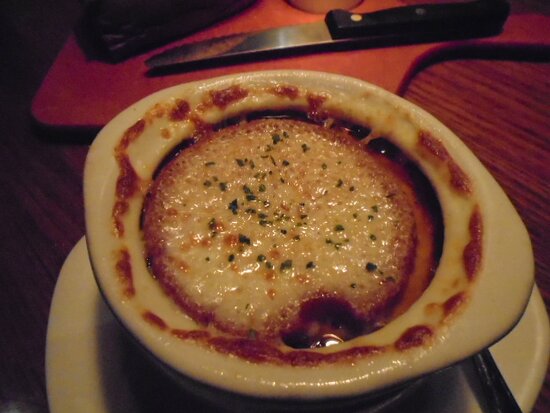
In order to click on knife handle in this screenshot , I will do `click(395, 21)`.